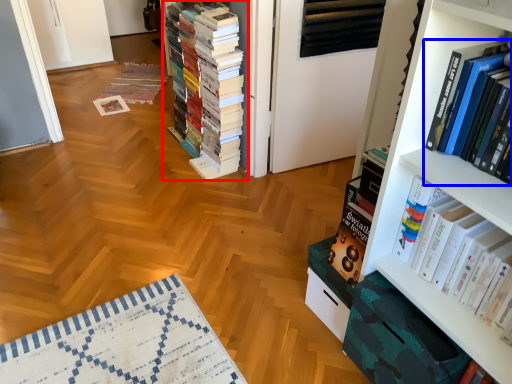
Question: Among these objects, which one is farthest to the camera, book (highlighted by a red box) or book (highlighted by a blue box)?

Choices:
 (A) book
 (B) book

Answer: (A)